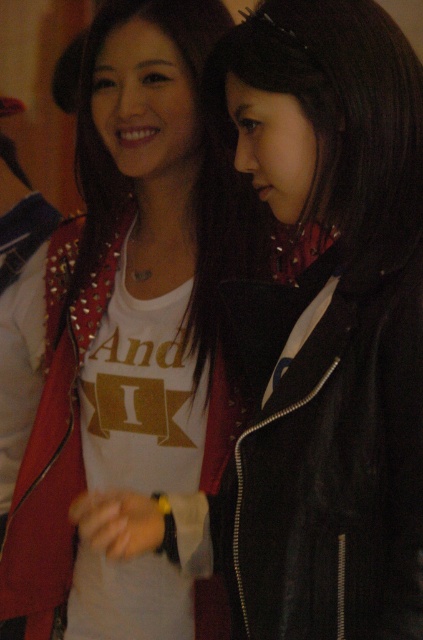
You are a photographer trying to capture both jackets in a single frame. Since the matte studded jacket at center and the black leather jacket at center are both at center, which one will appear taller in the photo?

The matte studded jacket at center will appear taller in the photo because it is taller than the black leather jacket at center.

Looking at this image, you are a photographer at an event and need to position two models wearing jackets for a photo. The models are standing at the center of the frame. You want to ensure the black leather jacket at center is to the right of the studded leather jacket at center. Based on the scene, is this current arrangement correct?

Yes, the current arrangement is correct because the black leather jacket at center is positioned to the right of the studded leather jacket at center as described.

You are a photographer at an event and need to capture both jackets clearly in a single frame. The matte studded jacket at center and the studded leather jacket at center are both in your view. Which jacket should you focus on first to ensure both are in focus?

The matte studded jacket at center is larger in size than the studded leather jacket at center, so focusing on the larger matte studded jacket at center first will help ensure both are in focus as it occupies more of the frame.